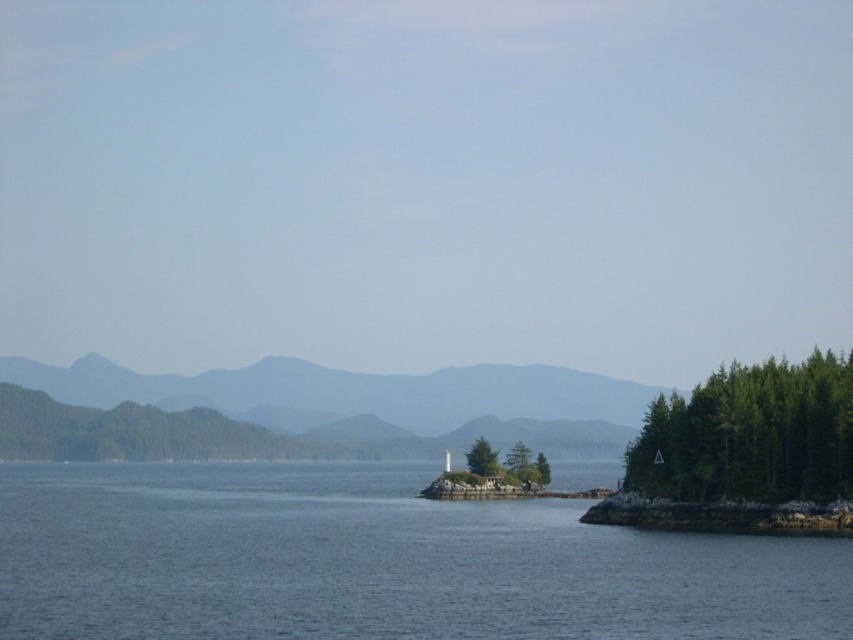
Question: Which object is positioned farthest from the green matte tree at center?

Choices:
 (A) gray textured mountain at center
 (B) green textured trees at right
 (C) blue water at center

Answer: (A)

Question: Where is gray textured mountain at center located in relation to green matte tree at center in the image?

Choices:
 (A) left
 (B) right

Answer: (A)

Question: From the image, what is the correct spatial relationship of blue water at center in relation to green textured trees at right?

Choices:
 (A) right
 (B) left

Answer: (B)

Question: Can you confirm if gray textured mountain at center is wider than green textured trees at right?

Choices:
 (A) yes
 (B) no

Answer: (A)

Question: Which point is farther to the camera?

Choices:
 (A) [x=474, y=474]
 (B) [x=743, y=445]
 (C) [x=598, y=394]
 (D) [x=250, y=563]

Answer: (C)

Question: Which object is the closest to the blue water at center?

Choices:
 (A) green matte tree at center
 (B) green textured trees at right
 (C) gray textured mountain at center

Answer: (B)